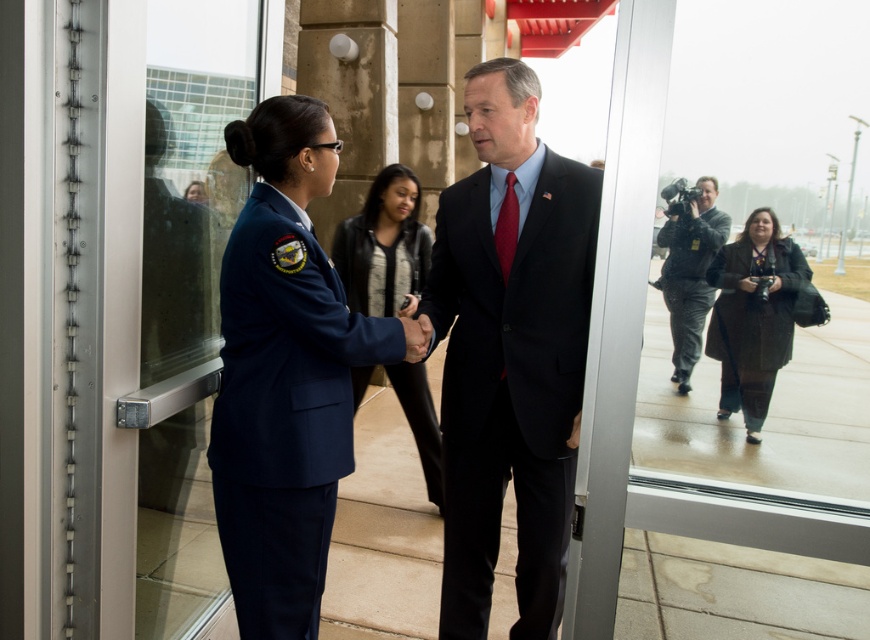
Question: In this image, where is black leather jacket at center located relative to dark brown textured coat at lower right?

Choices:
 (A) right
 (B) left

Answer: (B)

Question: Which of these objects is positioned farthest from the dark brown textured coat at lower right?

Choices:
 (A) dark blue suit at center
 (B) black leather jacket at center
 (C) navy blue uniform at center
 (D) gray fabric camera at right

Answer: (B)

Question: Is dark blue suit at center smaller than dark brown textured coat at lower right?

Choices:
 (A) no
 (B) yes

Answer: (A)

Question: Where is dark blue suit at center located in relation to navy blue uniform at center in the image?

Choices:
 (A) left
 (B) right

Answer: (B)

Question: Among these objects, which one is farthest from the camera?

Choices:
 (A) transparent glass door at left
 (B) gray fabric camera at right
 (C) navy blue uniform at center

Answer: (C)

Question: Estimate the real-world distances between objects in this image. Which object is closer to the transparent glass door at left?

Choices:
 (A) dark blue suit at center
 (B) gray fabric camera at right
 (C) black leather jacket at center
 (D) dark brown textured coat at lower right

Answer: (A)